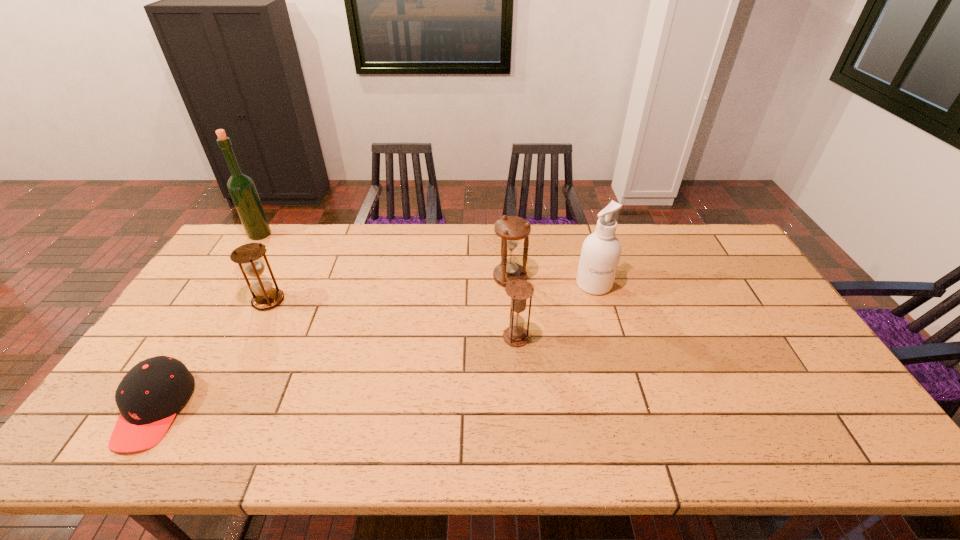
Where is `the tallest object`? This screenshot has height=540, width=960. the tallest object is located at coordinates (241, 187).

At what (x,y) coordinates should I click in order to perform the action: click on the farthest object. Please return your answer as a coordinate pair (x, y). Looking at the image, I should click on (241, 187).

You are a GUI agent. You are given a task and a screenshot of the screen. Output one action in this format:
    pyautogui.click(x=<x>, y=<y>)
    Task: Click on the cleansing agent
    The width and height of the screenshot is (960, 540).
    Given the screenshot: What is the action you would take?
    pyautogui.click(x=600, y=254)

The image size is (960, 540). Find the location of `the rightmost object`. the rightmost object is located at coordinates (600, 254).

Where is `the farthest hourglass`? The width and height of the screenshot is (960, 540). the farthest hourglass is located at coordinates (512, 229).

Locate an element on the screen. This screenshot has height=540, width=960. the second nearest hourglass is located at coordinates (248, 256).

Find the location of a particular element. the leftmost hourglass is located at coordinates (248, 256).

Where is `the fifth farthest object`? the fifth farthest object is located at coordinates (519, 290).

Identify the location of the nearest object. (149, 396).

You are a GUI agent. You are given a task and a screenshot of the screen. Output one action in this format:
    pyautogui.click(x=<x>, y=<y>)
    Task: Click on the shortest object
    Image resolution: width=960 pixels, height=540 pixels.
    Given the screenshot: What is the action you would take?
    pyautogui.click(x=149, y=396)